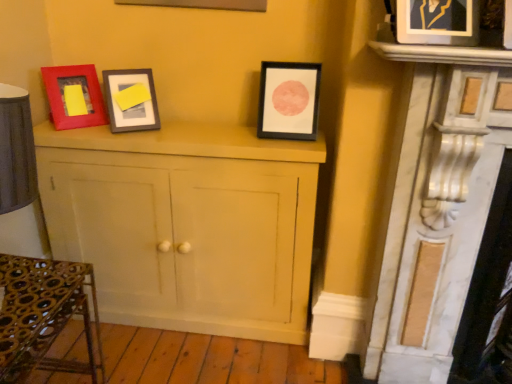
The image size is (512, 384). What do you see at coordinates (44, 315) in the screenshot?
I see `metallic wrought iron table at lower left` at bounding box center [44, 315].

The image size is (512, 384). Describe the element at coordinates (186, 224) in the screenshot. I see `matte white cabinet at center` at that location.

At what (x,y) coordinates should I click in order to perform the action: click on matte white cabinet at center. Please return your answer as a coordinate pair (x, y). The width and height of the screenshot is (512, 384). Looking at the image, I should click on (186, 224).

Locate an element on the screen. The image size is (512, 384). metallic gold picture frame at upper right, the 1th picture frame positioned from the right is located at coordinates (437, 22).

Describe the element at coordinates (437, 22) in the screenshot. I see `metallic gold picture frame at upper right, which ranks as the second picture frame in back-to-front order` at that location.

This screenshot has width=512, height=384. I want to click on white marble fireplace at right, so click(449, 217).

From a real-world perspective, is metallic wrought iron table at lower left below black matte picture frame at center, the second picture frame when ordered from right to left?

Yes, from a real-world perspective, metallic wrought iron table at lower left is under black matte picture frame at center, the second picture frame when ordered from right to left.

Is point (9, 279) more distant than point (319, 72)?

No, it is not.

How many degrees apart are the facing directions of metallic wrought iron table at lower left and black matte picture frame at center, arranged as the 1th picture frame when viewed from the back?

There is a 88.7-degree angle between the facing directions of metallic wrought iron table at lower left and black matte picture frame at center, arranged as the 1th picture frame when viewed from the back.

Considering the positions of objects metallic wrought iron table at lower left and black matte picture frame at center, the second picture frame when ordered from right to left, in the image provided, who is behind, metallic wrought iron table at lower left or black matte picture frame at center, the second picture frame when ordered from right to left,?

black matte picture frame at center, the second picture frame when ordered from right to left, is further from the camera.

What's the angular difference between black matte picture frame at center, arranged as the 1th picture frame when viewed from the left, and metallic gold picture frame at upper right, which is the 2th picture frame from left to right,'s facing directions?

The angle between the facing direction of black matte picture frame at center, arranged as the 1th picture frame when viewed from the left, and the facing direction of metallic gold picture frame at upper right, which is the 2th picture frame from left to right, is 17.8 degrees.

Is point (317, 65) closer to camera compared to point (421, 6)?

No, (317, 65) is behind (421, 6).

Is black matte picture frame at center, arranged as the 1th picture frame when viewed from the left, thinner than metallic gold picture frame at upper right, positioned as the first picture frame in front-to-back order?

Correct, the width of black matte picture frame at center, arranged as the 1th picture frame when viewed from the left, is less than that of metallic gold picture frame at upper right, positioned as the first picture frame in front-to-back order.

Is metallic gold picture frame at upper right, positioned as the first picture frame in front-to-back order, inside black matte picture frame at center, the second picture frame when ordered from right to left?

No, metallic gold picture frame at upper right, positioned as the first picture frame in front-to-back order, is not inside black matte picture frame at center, the second picture frame when ordered from right to left.

Considering the positions of objects white marble fireplace at right and black matte picture frame at center, the second picture frame when ordered from right to left, in the image provided, who is in front, white marble fireplace at right or black matte picture frame at center, the second picture frame when ordered from right to left,?

Positioned in front is white marble fireplace at right.

Can you tell me how much white marble fireplace at right and black matte picture frame at center, arranged as the 1th picture frame when viewed from the back, differ in facing direction?

They differ by 1.68 degrees in their facing directions.

Is white marble fireplace at right not inside black matte picture frame at center, arranged as the 1th picture frame when viewed from the back?

white marble fireplace at right is positioned outside black matte picture frame at center, arranged as the 1th picture frame when viewed from the back.

Is white marble fireplace at right beside black matte picture frame at center, arranged as the 1th picture frame when viewed from the back?

They are not placed beside each other.

From the picture: Looking at their sizes, would you say white marble fireplace at right is wider or thinner than metallic wrought iron table at lower left?

Clearly, white marble fireplace at right has less width compared to metallic wrought iron table at lower left.

Considering the positions of points (487, 151) and (48, 265), is point (487, 151) closer to camera compared to point (48, 265)?

Yes.

Is white marble fireplace at right to the left or to the right of metallic wrought iron table at lower left in the image?

Clearly, white marble fireplace at right is on the right of metallic wrought iron table at lower left in the image.

Considering the relative sizes of white marble fireplace at right and metallic wrought iron table at lower left in the image provided, is white marble fireplace at right smaller than metallic wrought iron table at lower left?

No, white marble fireplace at right is not smaller than metallic wrought iron table at lower left.

Between point (410, 38) and point (298, 99), which one is positioned in front?

Positioned in front is point (410, 38).

Would you consider metallic gold picture frame at upper right, which ranks as the second picture frame in back-to-front order, to be distant from black matte picture frame at center, arranged as the 1th picture frame when viewed from the left?

Actually, metallic gold picture frame at upper right, which ranks as the second picture frame in back-to-front order, and black matte picture frame at center, arranged as the 1th picture frame when viewed from the left, are a little close together.

This screenshot has height=384, width=512. In order to click on picture frame behind the metallic gold picture frame at upper right, the 1th picture frame positioned from the right in this screenshot , I will do `click(289, 100)`.

Is metallic gold picture frame at upper right, positioned as the first picture frame in front-to-back order, smaller than black matte picture frame at center, arranged as the 1th picture frame when viewed from the left?

Correct, metallic gold picture frame at upper right, positioned as the first picture frame in front-to-back order, occupies less space than black matte picture frame at center, arranged as the 1th picture frame when viewed from the left.

Does metallic wrought iron table at lower left lie in front of white marble fireplace at right?

Yes, metallic wrought iron table at lower left is closer to the viewer.

Are metallic wrought iron table at lower left and white marble fireplace at right far apart?

metallic wrought iron table at lower left is far away from white marble fireplace at right.

Can you confirm if metallic wrought iron table at lower left is taller than white marble fireplace at right?

No.

Is metallic wrought iron table at lower left outside of white marble fireplace at right?

metallic wrought iron table at lower left lies outside white marble fireplace at right's area.

Is matte white cabinet at center far from metallic wrought iron table at lower left?

No, there isn't a large distance between matte white cabinet at center and metallic wrought iron table at lower left.

Based on their positions, is matte white cabinet at center located to the left or right of metallic wrought iron table at lower left?

Clearly, matte white cabinet at center is on the right of metallic wrought iron table at lower left in the image.

Looking at their sizes, would you say matte white cabinet at center is wider or thinner than metallic wrought iron table at lower left?

In the image, matte white cabinet at center appears to be more narrow than metallic wrought iron table at lower left.

Where is `furniture that is in front of the matte white cabinet at center`? This screenshot has height=384, width=512. furniture that is in front of the matte white cabinet at center is located at coordinates (44, 315).

Where is `furniture beneath the black matte picture frame at center, arranged as the 1th picture frame when viewed from the back (from a real-world perspective)`? furniture beneath the black matte picture frame at center, arranged as the 1th picture frame when viewed from the back (from a real-world perspective) is located at coordinates (44, 315).

Locate an element on the screen. This screenshot has height=384, width=512. picture frame in front of the black matte picture frame at center, the second picture frame when ordered from right to left is located at coordinates (437, 22).

From the image, which object appears to be farther from matte white cabinet at center, metallic gold picture frame at upper right, the 1th picture frame positioned from the right, or metallic wrought iron table at lower left?

The object further to matte white cabinet at center is metallic gold picture frame at upper right, the 1th picture frame positioned from the right.

Considering their positions, is metallic gold picture frame at upper right, which is the 2th picture frame from left to right, positioned further to metallic wrought iron table at lower left than black matte picture frame at center, arranged as the 1th picture frame when viewed from the left?

metallic gold picture frame at upper right, which is the 2th picture frame from left to right.

When comparing their distances from matte white cabinet at center, does black matte picture frame at center, the second picture frame when ordered from right to left, or metallic gold picture frame at upper right, which ranks as the second picture frame in back-to-front order, seem further?

Among the two, metallic gold picture frame at upper right, which ranks as the second picture frame in back-to-front order, is located further to matte white cabinet at center.

From the image, which object appears to be nearer to metallic wrought iron table at lower left, metallic gold picture frame at upper right, positioned as the first picture frame in front-to-back order, or white marble fireplace at right?

Based on the image, white marble fireplace at right appears to be nearer to metallic wrought iron table at lower left.

Based on their spatial positions, is metallic gold picture frame at upper right, the 1th picture frame positioned from the right, or white marble fireplace at right further from matte white cabinet at center?

metallic gold picture frame at upper right, the 1th picture frame positioned from the right, is further to matte white cabinet at center.

Which object lies nearer to the anchor point white marble fireplace at right, matte white cabinet at center or metallic gold picture frame at upper right, the 1th picture frame positioned from the right?

The object closer to white marble fireplace at right is metallic gold picture frame at upper right, the 1th picture frame positioned from the right.

Looking at the image, which one is located closer to metallic gold picture frame at upper right, which ranks as the second picture frame in back-to-front order, metallic wrought iron table at lower left or matte white cabinet at center?

matte white cabinet at center is closer to metallic gold picture frame at upper right, which ranks as the second picture frame in back-to-front order.

When comparing their distances from metallic gold picture frame at upper right, positioned as the first picture frame in front-to-back order, does metallic wrought iron table at lower left or black matte picture frame at center, arranged as the 1th picture frame when viewed from the left, seem closer?

black matte picture frame at center, arranged as the 1th picture frame when viewed from the left, lies closer to metallic gold picture frame at upper right, positioned as the first picture frame in front-to-back order, than the other object.

You are a GUI agent. You are given a task and a screenshot of the screen. Output one action in this format:
    pyautogui.click(x=<x>, y=<y>)
    Task: Click on the picture frame between metallic gold picture frame at upper right, the 1th picture frame positioned from the right, and white marble fireplace at right in the up-down direction
    This screenshot has height=384, width=512.
    Given the screenshot: What is the action you would take?
    pyautogui.click(x=289, y=100)

This screenshot has width=512, height=384. I want to click on cabinetry located between metallic wrought iron table at lower left and white marble fireplace at right in the left-right direction, so click(x=186, y=224).

The width and height of the screenshot is (512, 384). What are the coordinates of `picture frame between matte white cabinet at center and metallic gold picture frame at upper right, which ranks as the second picture frame in back-to-front order` in the screenshot? It's located at (289, 100).

You are a GUI agent. You are given a task and a screenshot of the screen. Output one action in this format:
    pyautogui.click(x=<x>, y=<y>)
    Task: Click on the cabinetry between black matte picture frame at center, arranged as the 1th picture frame when viewed from the back, and metallic wrought iron table at lower left in the up-down direction
    
    Given the screenshot: What is the action you would take?
    pyautogui.click(x=186, y=224)